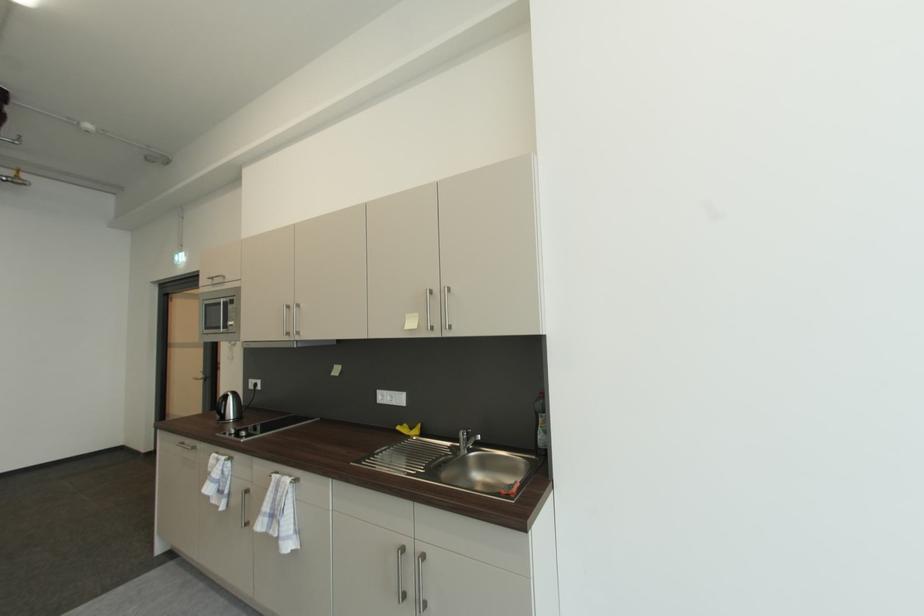
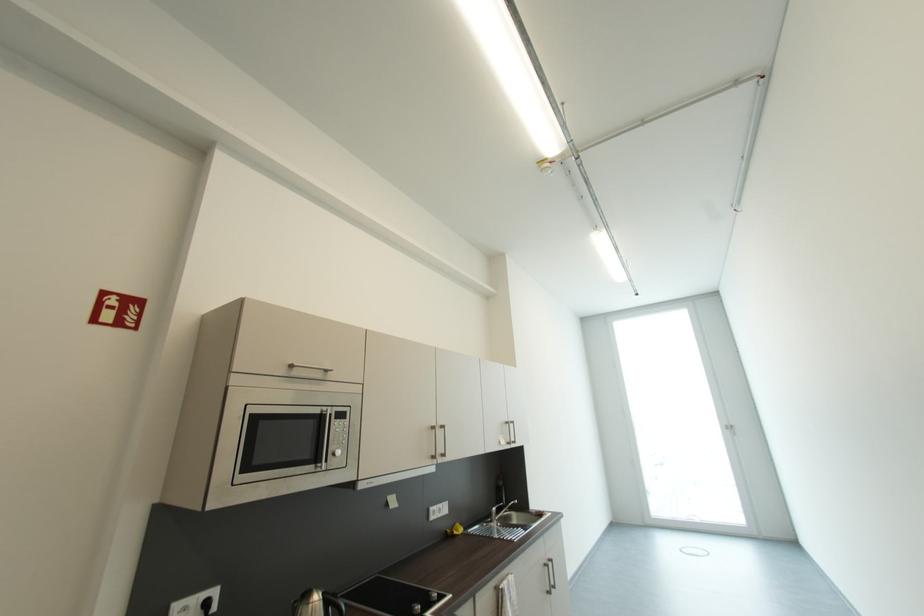
The point at (237,302) is marked in the first image. Where is the corresponding point in the second image?

(342, 413)